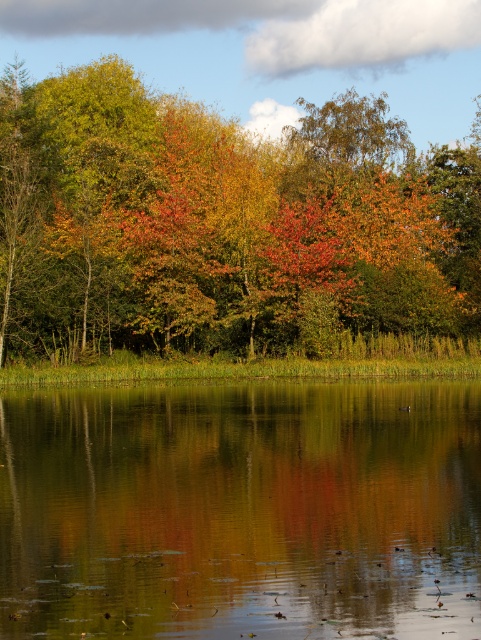
You are an artist planning to paint the autumn scene. You want to ensure the green reflective water at center and autumn foliage at center are proportionally accurate. Which object should you paint first to maintain the correct size relationship?

The green reflective water at center has a lesser width compared to autumn foliage at center, so you should paint the autumn foliage at center first to establish the larger size before adjusting the smaller green reflective water at center.

You are standing at the edge of the scene and want to step onto the green reflective water at center. Is the water within your immediate reach based on its position?

The green reflective water at center is located at point (x=240, y=512), which means it is positioned towards the right side and middle of the scene. Since you are at the edge, you would need to move towards the right to reach it.